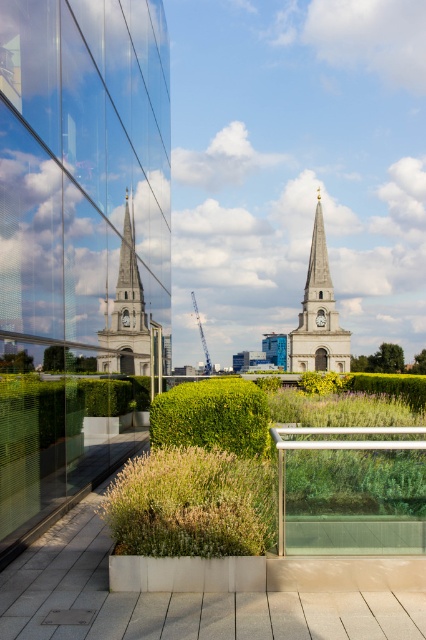
Between green leafy hedge at center and white stone clock tower at center, which one appears on the left side from the viewer's perspective?

Positioned to the left is green leafy hedge at center.

Between point (178, 429) and point (316, 346), which one is positioned in front?

Point (178, 429)

Is point (178, 396) farther from viewer compared to point (333, 356)?

No, (178, 396) is in front of (333, 356).

Where is `green leafy hedge at center`? green leafy hedge at center is located at coordinates (213, 417).

This screenshot has height=640, width=426. What do you see at coordinates (78, 248) in the screenshot?
I see `white stone church at center` at bounding box center [78, 248].

Measure the distance between point (85, 257) and camera.

54.01 meters

Find the location of `white stone church at center`. white stone church at center is located at coordinates (78, 248).

Who is more distant from viewer, (135, 81) or (169, 392)?

The point (135, 81) is behind.

Can you confirm if white stone church at center is positioned to the left of green leafy hedge at center?

Indeed, white stone church at center is positioned on the left side of green leafy hedge at center.

This screenshot has height=640, width=426. Describe the element at coordinates (78, 248) in the screenshot. I see `white stone church at center` at that location.

You are a GUI agent. You are given a task and a screenshot of the screen. Output one action in this format:
    pyautogui.click(x=<x>, y=<y>)
    Task: Click on the white stone church at center
    
    Given the screenshot: What is the action you would take?
    pyautogui.click(x=78, y=248)